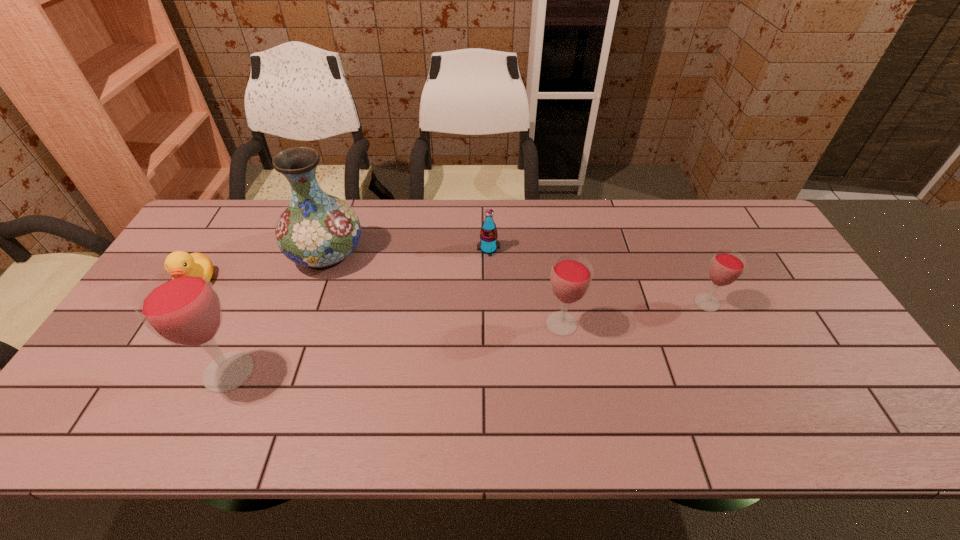
Find the location of a particular element. The width and height of the screenshot is (960, 540). free space for an extra wineglass to achieve even spacing is located at coordinates (402, 347).